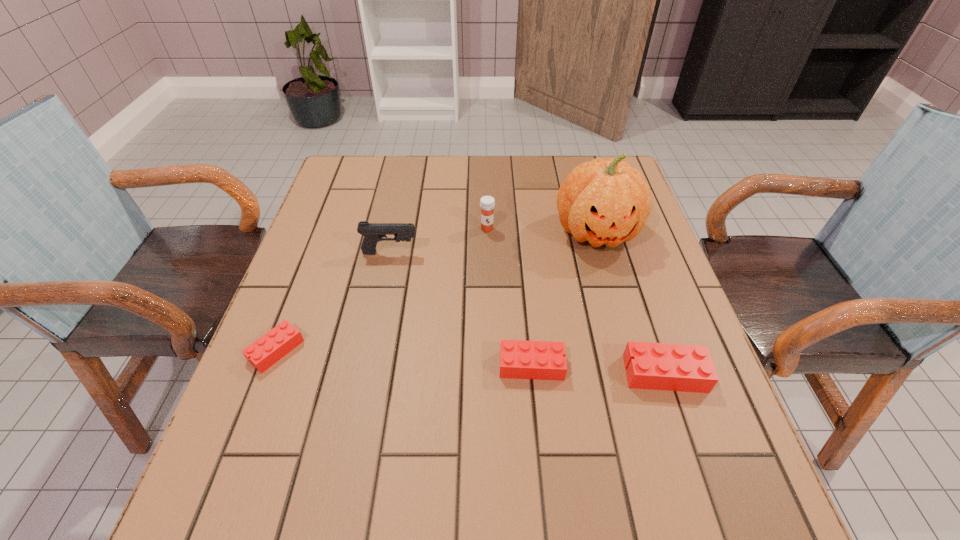
Find the location of a particular element. The image size is (960, 540). vacant area at the near edge of the desktop is located at coordinates (585, 435).

Find the location of a particular element. vacant region at the left edge of the desktop is located at coordinates (261, 392).

At what (x,y) coordinates should I click in order to perform the action: click on vacant region at the right edge of the desktop. Please return your answer as a coordinate pair (x, y). Looking at the image, I should click on (638, 399).

This screenshot has width=960, height=540. I want to click on vacant space at the far left corner of the desktop, so click(x=372, y=197).

Locate an element on the screen. The image size is (960, 540). free space that is in between the fifth object from right to left and the leftmost Lego is located at coordinates (333, 301).

You are a GUI agent. You are given a task and a screenshot of the screen. Output one action in this format:
    pyautogui.click(x=<x>, y=<y>)
    Task: Click on the free space between the pistol and the leftmost Lego
    This screenshot has width=960, height=540.
    Given the screenshot: What is the action you would take?
    pyautogui.click(x=333, y=301)

You are a GUI agent. You are given a task and a screenshot of the screen. Output one action in this format:
    pyautogui.click(x=<x>, y=<y>)
    Task: Click on the free point between the fourth object from right to left and the second shortest Lego
    
    Given the screenshot: What is the action you would take?
    pyautogui.click(x=509, y=297)

You are a GUI agent. You are given a task and a screenshot of the screen. Output one action in this format:
    pyautogui.click(x=<x>, y=<y>)
    Task: Click on the free space between the shortest object and the fourth object from right to left
    This screenshot has width=960, height=540.
    Given the screenshot: What is the action you would take?
    pyautogui.click(x=382, y=289)

In order to click on free point between the pistol and the pumpkin in this screenshot , I will do `click(493, 242)`.

Find the location of a particular element. This screenshot has height=540, width=960. free spot between the second Lego from left to right and the second object from left to right is located at coordinates (461, 309).